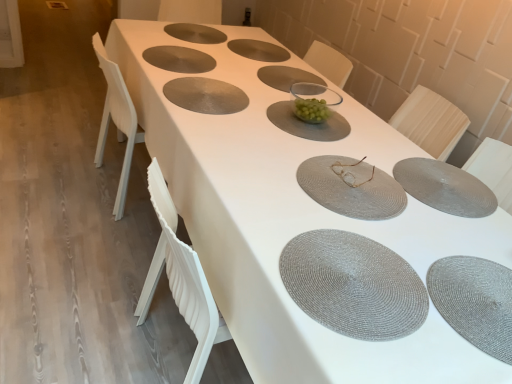
The width and height of the screenshot is (512, 384). Find the location of `free space in front of matte gray placemat at upper center, the 7th tableware ordered from the bottom`. free space in front of matte gray placemat at upper center, the 7th tableware ordered from the bottom is located at coordinates (181, 80).